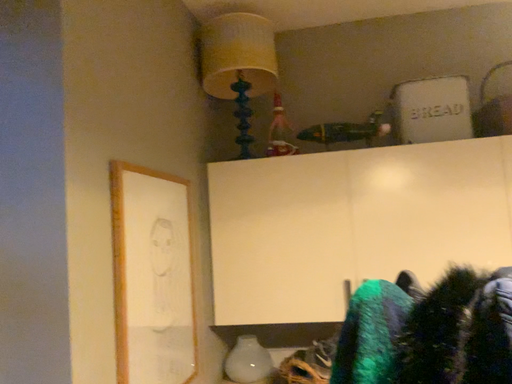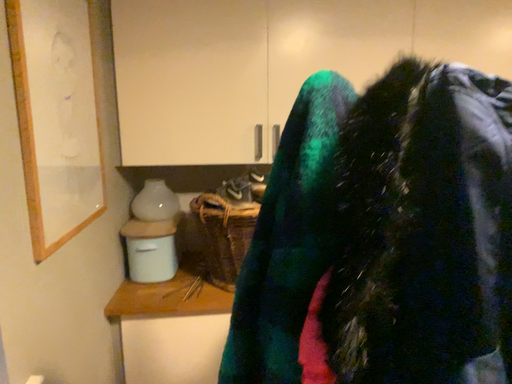
Question: Which way did the camera rotate in the video?

Choices:
 (A) rotated left
 (B) rotated right

Answer: (B)